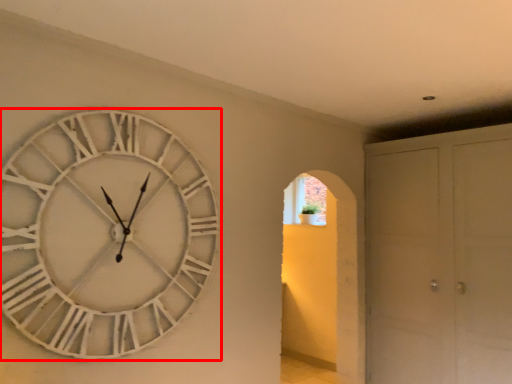
Question: From the image's perspective, where is wall clock (annotated by the red box) located relative to glass door?

Choices:
 (A) below
 (B) above

Answer: (B)